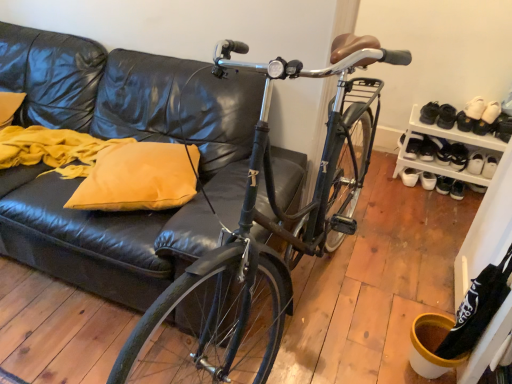
Question: Considering the positions of white matte sneakers at lower right, which ranks as the 2th footwear in left-to-right order, and white leather shoe at upper right, the 2th shoe viewed from the back, in the image, is white matte sneakers at lower right, which ranks as the 2th footwear in left-to-right order, bigger or smaller than white leather shoe at upper right, the 2th shoe viewed from the back,?

Choices:
 (A) big
 (B) small

Answer: (A)

Question: Choose the correct answer: Is white matte sneakers at lower right, which ranks as the eighth footwear in right-to-left order, inside white leather shoe at upper right, marked as the first shoe in a right-to-left arrangement, or outside it?

Choices:
 (A) inside
 (B) outside

Answer: (B)

Question: Considering the real-world distances, which object is closest to the white matte sneakers at lower right, which ranks as the 2th footwear in left-to-right order?

Choices:
 (A) white suede shoes at upper right, which ranks as the sixth footwear in left-to-right order
 (B) white leather shoe at lower right, positioned as the 1th footwear in right-to-left order
 (C) shiny black bicycle at center
 (D) black leather shoe at upper right, which is counted as the seventh footwear, starting from the right
 (E) white leather shoe at right, which is the second footwear in right-to-left order

Answer: (E)

Question: Estimate the real-world distances between objects in this image. Which object is closer to the white leather shoe at right, which is the second footwear in right-to-left order?

Choices:
 (A) black suede shoe at lower right, the fifth footwear in the left-to-right sequence
 (B) white leather shoe at lower right, which is the 9th footwear from left to right
 (C) white leather shoe at upper right, the second shoe positioned from the left
 (D) black leather shoe at upper right, which is counted as the seventh footwear, starting from the right
 (E) shiny black bicycle at center

Answer: (B)